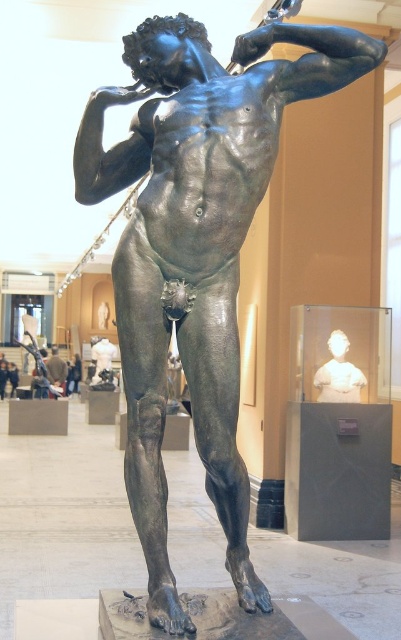
Question: Can you confirm if white marble bust at center is positioned to the left of bronze statue at center?

Choices:
 (A) no
 (B) yes

Answer: (A)

Question: Can you confirm if white marble bust at center is smaller than bronze statue at center?

Choices:
 (A) no
 (B) yes

Answer: (B)

Question: Does white marble bust at center appear on the right side of bronze statue at center?

Choices:
 (A) no
 (B) yes

Answer: (B)

Question: Among these points, which one is farthest from the camera?

Choices:
 (A) (354, 388)
 (B) (62, 380)

Answer: (B)

Question: Which point appears closest to the camera in this image?

Choices:
 (A) (62, 374)
 (B) (338, 369)

Answer: (B)